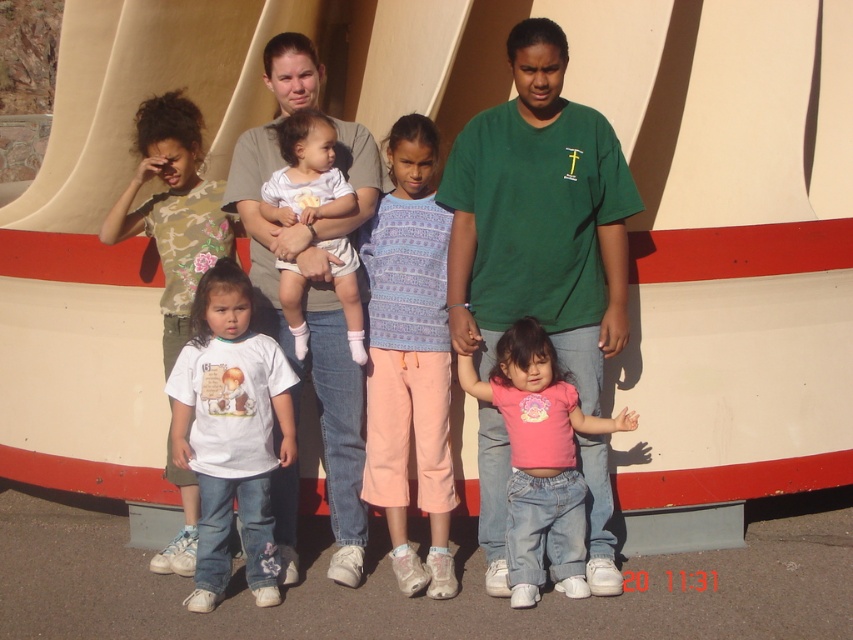
You are a photographer trying to capture a group photo of the purple knit sweater at center and the white cotton shirt at center. Since you want to ensure both are visible in the frame, which clothing item should you focus on first to avoid cropping the top of either?

The purple knit sweater at center is taller than the white cotton shirt at center, so you should focus on the purple knit sweater at center first to ensure its full height is captured without cropping.

You are standing in front of the large curved structure and want to move from the point at coordinates point [483,483] to the point at coordinates point [339,280]. Which direction should you move to get closer to the structure?

Since point [483,483] is further to the viewer than point [339,280], you should move towards the structure in the direction of point [339,280] to get closer.